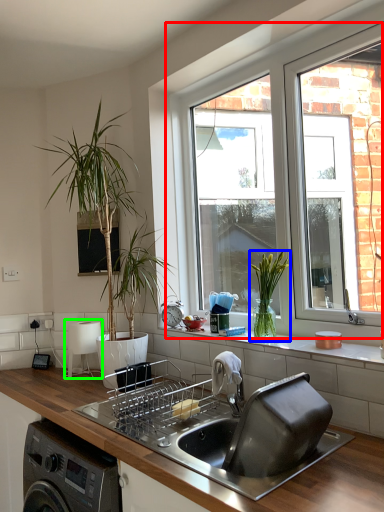
Question: Estimate the real-world distances between objects in this image. Which object is farther from window (highlighted by a red box), houseplant (highlighted by a blue box) or appliance (highlighted by a green box)?

Choices:
 (A) houseplant
 (B) appliance

Answer: (B)